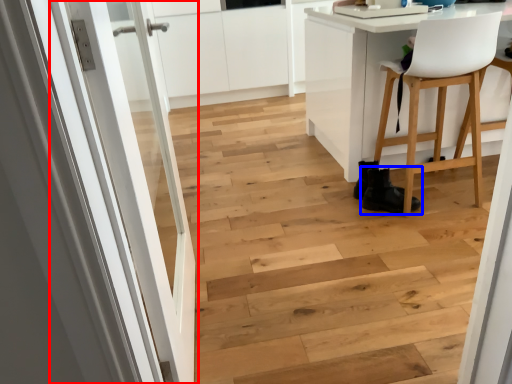
Question: Among these objects, which one is nearest to the camera, door (highlighted by a red box) or footwear (highlighted by a blue box)?

Choices:
 (A) door
 (B) footwear

Answer: (A)